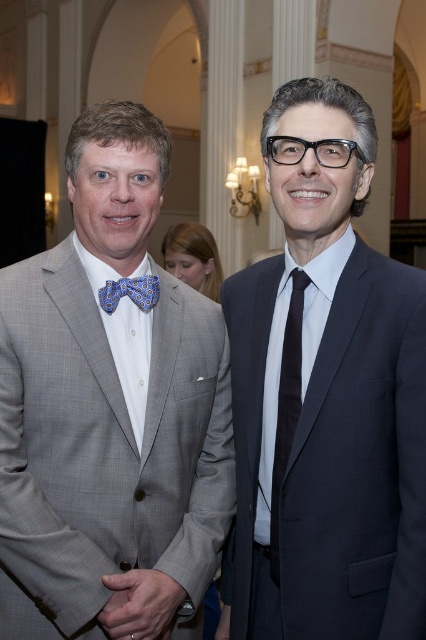
Question: In this image, where is gray textured suit at left located relative to blue patterned bow tie at left?

Choices:
 (A) left
 (B) right

Answer: (A)

Question: Is satin black suit at center wider than black silk tie at center?

Choices:
 (A) yes
 (B) no

Answer: (A)

Question: Which of the following is the farthest from the observer?

Choices:
 (A) black silk tie at center
 (B) satin black suit at center

Answer: (A)

Question: Which point is closer to the camera?

Choices:
 (A) gray textured suit at left
 (B) black silk tie at center

Answer: (A)

Question: Among these points, which one is nearest to the camera?

Choices:
 (A) (284, 212)
 (B) (287, 426)
 (C) (154, 291)

Answer: (B)

Question: Is gray textured suit at left smaller than black silk tie at center?

Choices:
 (A) no
 (B) yes

Answer: (A)